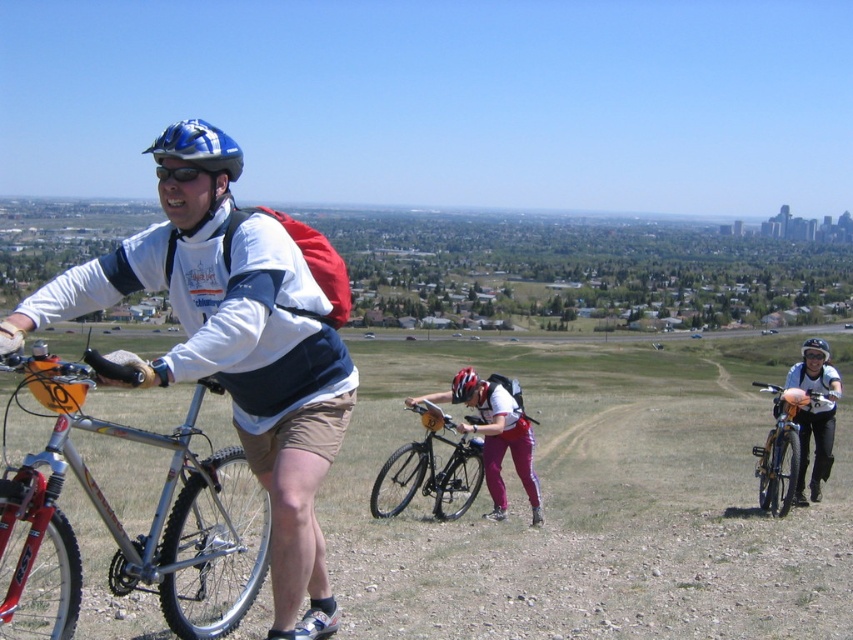
You are a photographer positioned at the base of the hill. You want to capture a photo of the shiny black bicycle at center and the matte black bicycle at right. Which bicycle will appear larger in the photo?

The shiny black bicycle at center will appear larger in the photo because it is located above the matte black bicycle at right, meaning it is closer to the photographer at the base of the hill.

You are trying to decide which object takes up more space in the image. Based on the scene, which one is smaller between the matte black bicycle at right and the shiny black helmet at center?

The matte black bicycle at right occupies less space than the shiny black helmet at center, so the matte black bicycle at right is smaller.

You are a photographer positioned behind the shiny black bicycle at center and want to take a photo of the silver metallic mountain bike at left. Can you see it clearly without moving your position?

The silver metallic mountain bike at left is in front of the shiny black bicycle at center, so yes, you can see it clearly from your current position behind the shiny black bicycle at center.